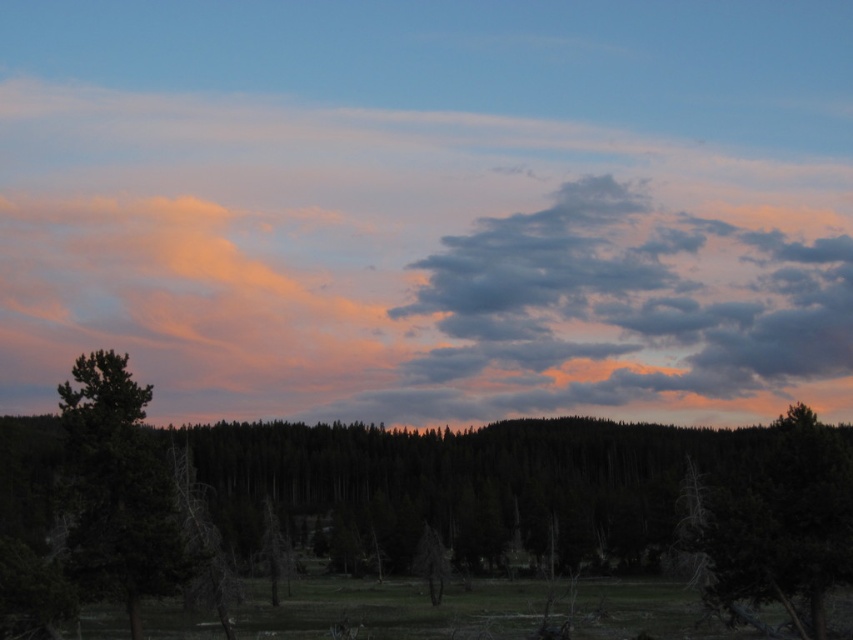
Can you confirm if dark green forest at center is shorter than green matte tree at left?

Incorrect, dark green forest at center's height does not fall short of green matte tree at left's.

Who is lower down, dark green forest at center or green matte tree at left?

dark green forest at center is below.

Which is in front, point (456, 497) or point (102, 394)?

Positioned in front is point (102, 394).

The width and height of the screenshot is (853, 640). In order to click on dark green forest at center in this screenshot , I will do `click(480, 483)`.

Between point (364, 300) and point (850, 573), which one is positioned behind?

Point (364, 300)

Does pastel cotton clouds at center have a lesser height compared to green matte tree at center?

No, pastel cotton clouds at center is not shorter than green matte tree at center.

Image resolution: width=853 pixels, height=640 pixels. Identify the location of pastel cotton clouds at center. (412, 262).

I want to click on pastel cotton clouds at center, so click(x=412, y=262).

Between dark green forest at center and green matte tree at center, which one appears on the left side from the viewer's perspective?

Positioned to the left is dark green forest at center.

Is dark green forest at center shorter than green matte tree at center?

No, dark green forest at center is not shorter than green matte tree at center.

Who is more distant from viewer, (683, 440) or (822, 451)?

The point (683, 440) is behind.

Locate an element on the screen. The width and height of the screenshot is (853, 640). dark green forest at center is located at coordinates (480, 483).